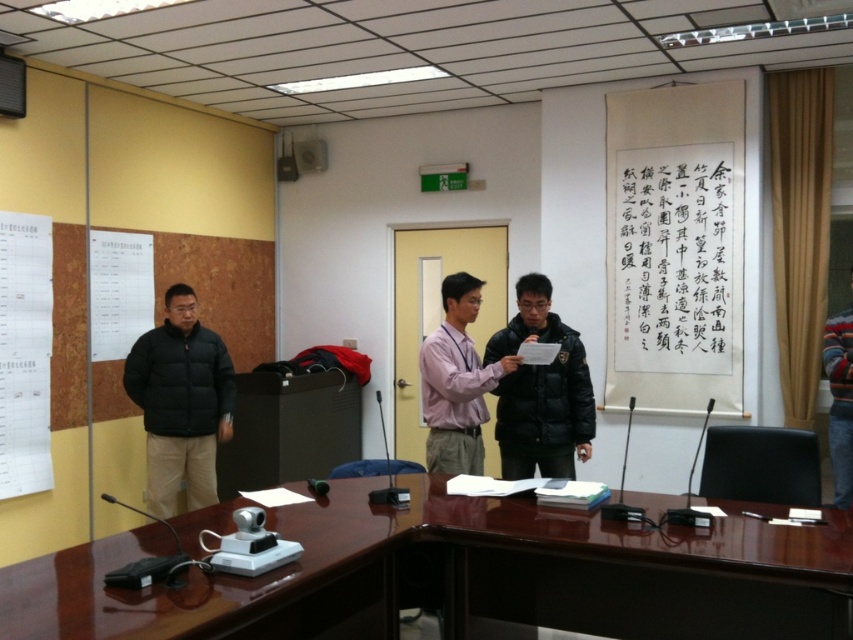
Question: From the image, what is the correct spatial relationship of black puffy jacket at center in relation to pink matte shirt at center?

Choices:
 (A) right
 (B) left

Answer: (A)

Question: Can you confirm if brown polished wood table at center is smaller than black matte jacket at left?

Choices:
 (A) no
 (B) yes

Answer: (A)

Question: Does brown polished wood table at center appear under pink matte shirt at center?

Choices:
 (A) no
 (B) yes

Answer: (B)

Question: Which of the following is the closest to the observer?

Choices:
 (A) (640, 570)
 (B) (422, 368)
 (C) (727, 104)
 (D) (169, 305)

Answer: (A)

Question: Which object is closer to the camera taking this photo?

Choices:
 (A) white paper at upper right
 (B) black matte jacket at left
 (C) black puffy jacket at center

Answer: (C)

Question: Estimate the real-world distances between objects in this image. Which object is farther from the black puffy jacket at center?

Choices:
 (A) brown polished wood table at center
 (B) white paper at upper right

Answer: (B)